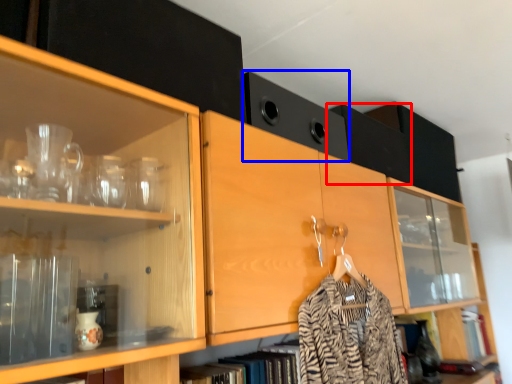
Question: Among these objects, which one is nearest to the camera, cabinetry (highlighted by a red box) or cabinetry (highlighted by a blue box)?

Choices:
 (A) cabinetry
 (B) cabinetry

Answer: (B)